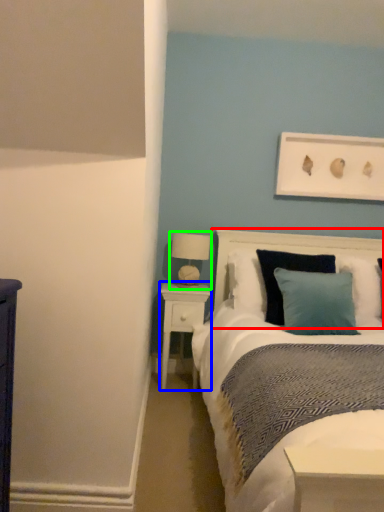
Question: Which object is positioned closest to headboard (highlighted by a red box)? Select from nightstand (highlighted by a blue box) and table lamp (highlighted by a green box).

Choices:
 (A) nightstand
 (B) table lamp

Answer: (B)